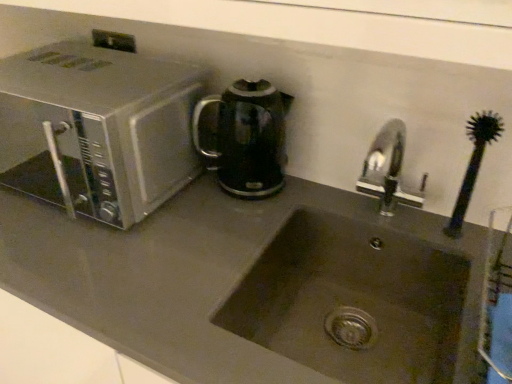
Find the location of `blank space to the left of black glossy electric kettle at center`. blank space to the left of black glossy electric kettle at center is located at coordinates (186, 199).